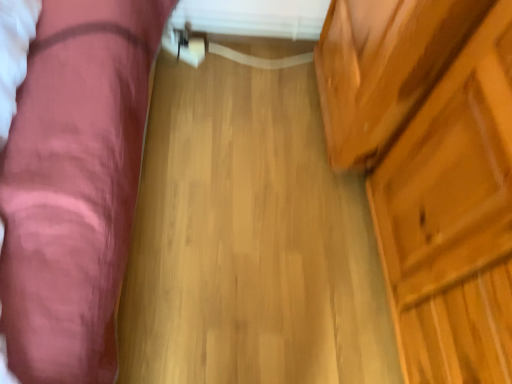
Locate an element on the screen. The width and height of the screenshot is (512, 384). free spot above natural wood floor at center (from a real-world perspective) is located at coordinates (286, 198).